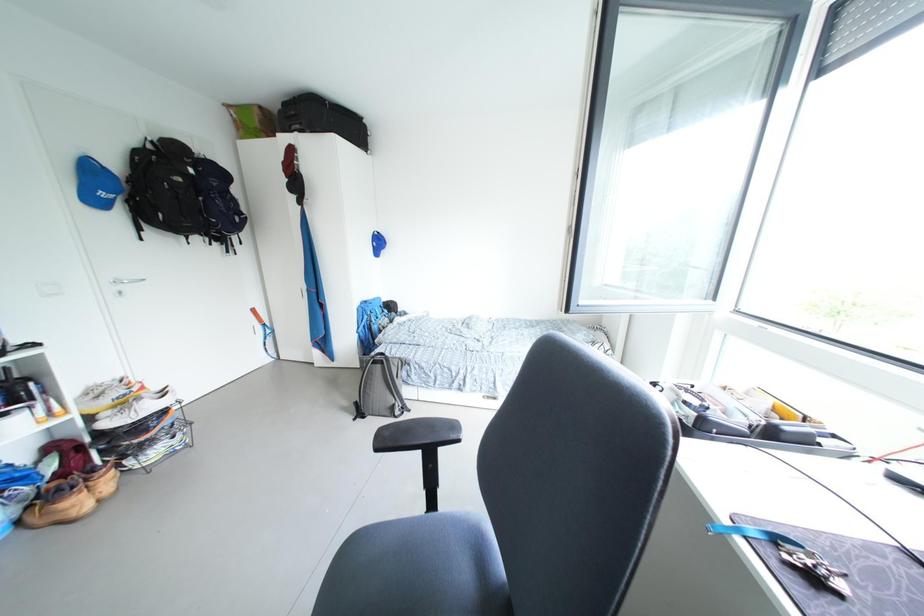
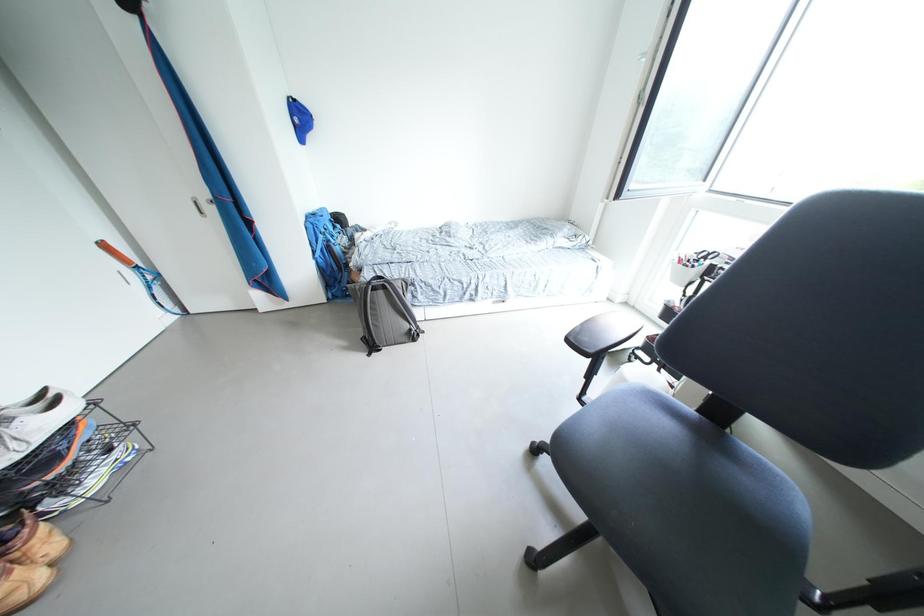
The first image is from the beginning of the video and the second image is from the end. How did the camera likely rotate when shooting the video?

The camera rotated toward right-down.